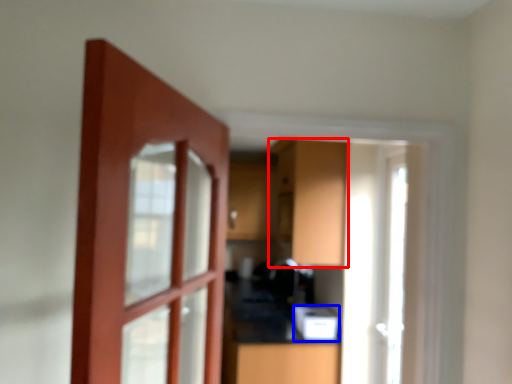
Question: Among these objects, which one is farthest to the camera, cabinetry (highlighted by a red box) or appliance (highlighted by a blue box)?

Choices:
 (A) cabinetry
 (B) appliance

Answer: (B)